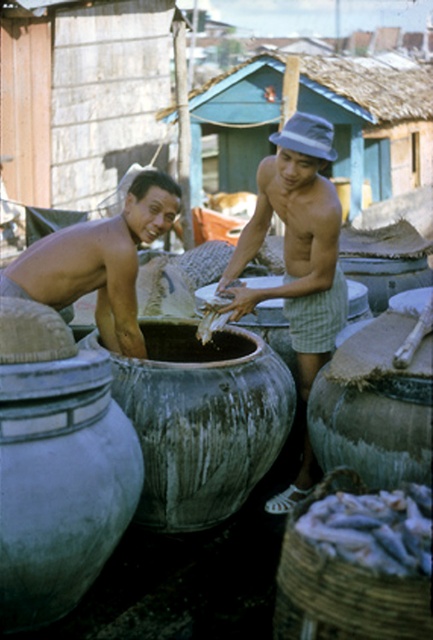
Question: Which object is farther from the camera taking this photo?

Choices:
 (A) smooth white rice at center
 (B) silvery fish at lower right
 (C) matte gray hat at center
 (D) smooth skin torso at left

Answer: (A)

Question: Is smooth skin torso at left closer to the viewer compared to smooth white rice at center?

Choices:
 (A) no
 (B) yes

Answer: (B)

Question: Among these points, which one is nearest to the camera?

Choices:
 (A) (404, 570)
 (B) (110, 346)
 (C) (203, 308)

Answer: (A)

Question: Can you confirm if silvery fish at lower right is thinner than smooth white rice at center?

Choices:
 (A) no
 (B) yes

Answer: (A)

Question: Which object appears farthest from the camera in this image?

Choices:
 (A) matte gray hat at center
 (B) silvery fish at lower right
 (C) smooth white rice at center
 (D) smooth skin torso at left

Answer: (C)

Question: Does matte gray hat at center have a larger size compared to smooth white rice at center?

Choices:
 (A) no
 (B) yes

Answer: (B)